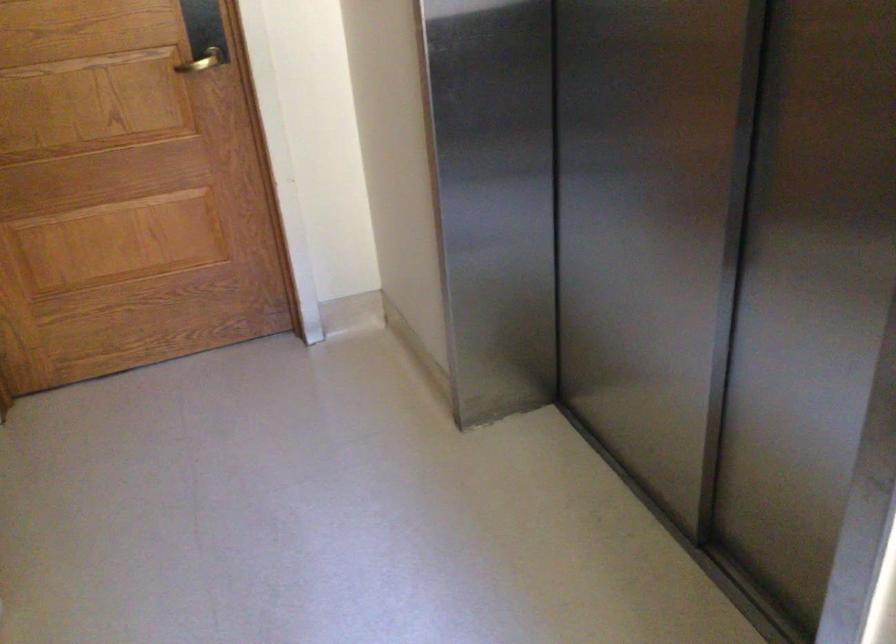
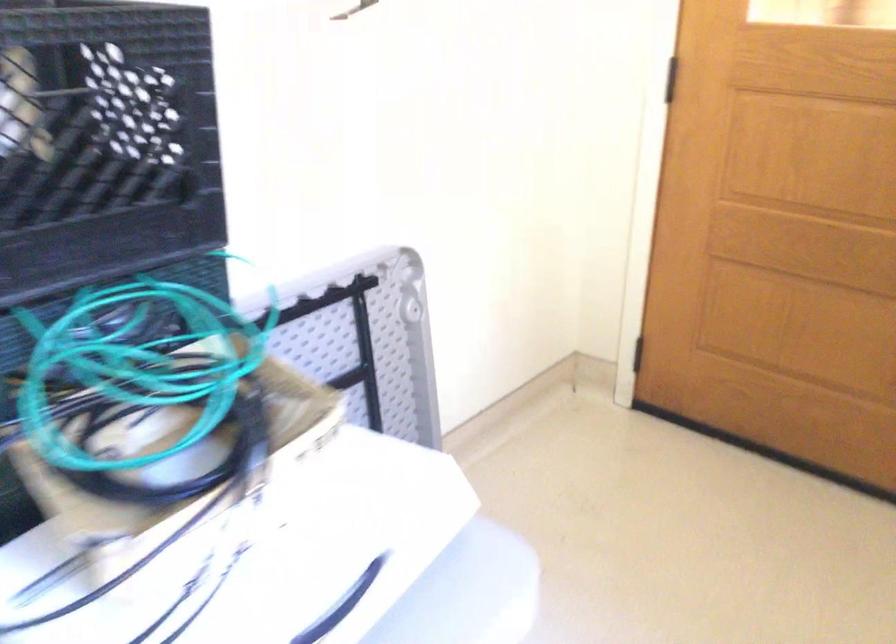
Question: What movement of the cameraman would produce the second image?

Choices:
 (A) Left
 (B) Right
 (C) Forward
 (D) Backward

Answer: (B)